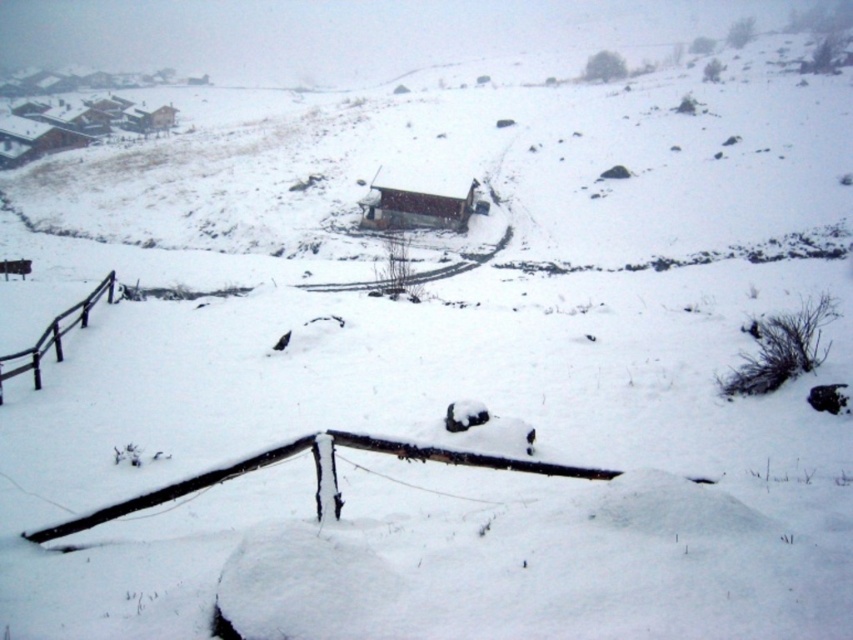
You are planning to build a new shed in your backyard and want to ensure it will be large enough to store your winter gear. You see the wooden cabin at center and the black wood rail at left in the image. Which object in the image is bigger in size?

The wooden cabin at center is larger in size compared to the black wood rail at left, so the cabin would be a better reference for ensuring your shed is big enough to store winter gear.